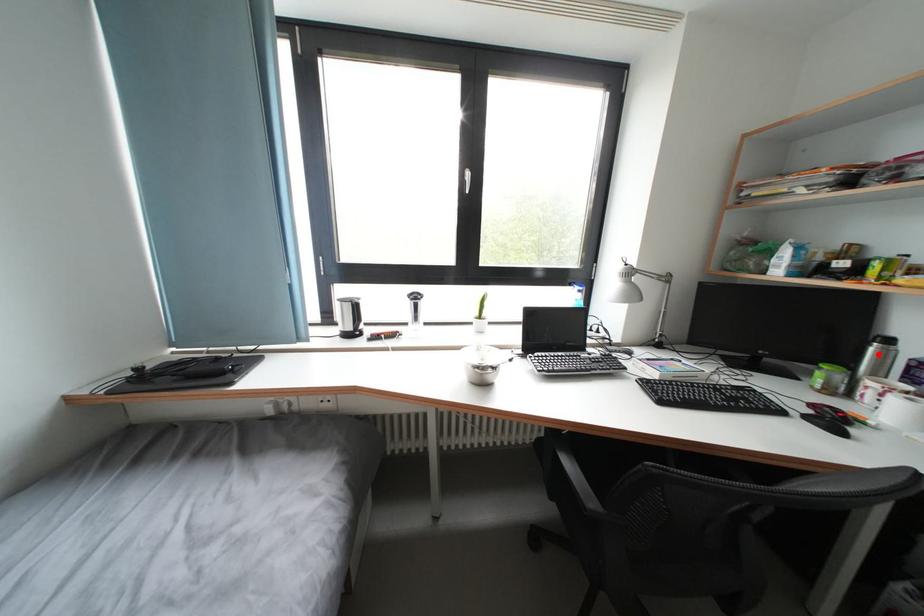
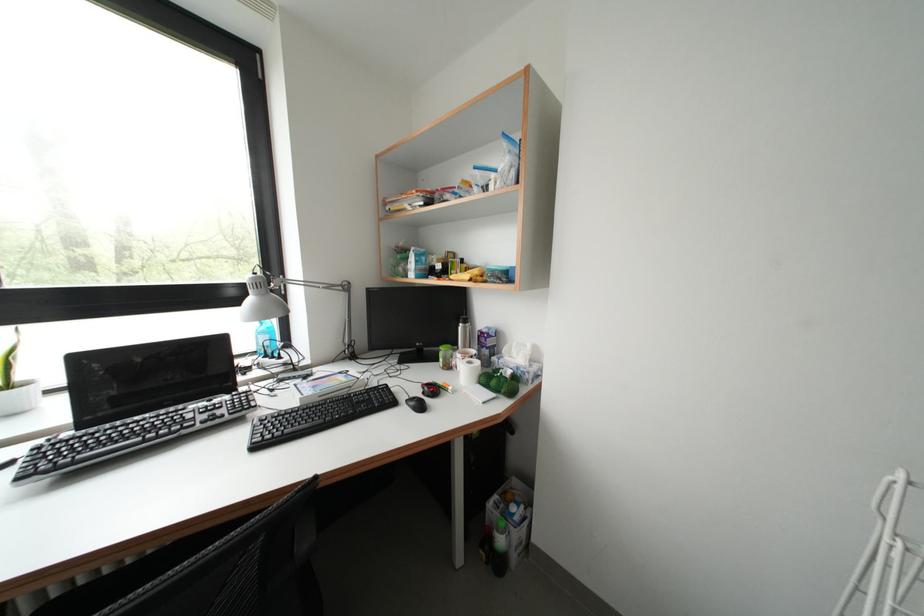
Where in the second image is the point corresponding to the highlighted location from the first image?

(467, 333)